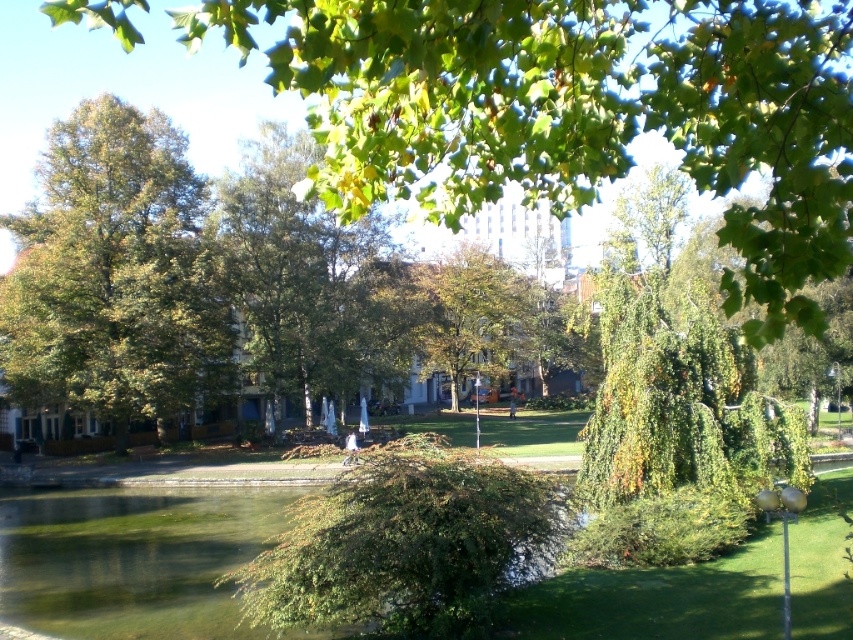
Which is below, green leafy tree at left or green translucent water at lower left?

green translucent water at lower left is lower down.

Who is positioned more to the right, green leafy tree at left or green translucent water at lower left?

Positioned to the right is green translucent water at lower left.

Locate an element on the screen. green leafy tree at left is located at coordinates click(x=114, y=273).

Image resolution: width=853 pixels, height=640 pixels. What are the coordinates of `green leafy tree at left` in the screenshot? It's located at (114, 273).

What do you see at coordinates (578, 113) in the screenshot?
I see `green leafy tree at upper center` at bounding box center [578, 113].

Who is more distant from viewer, (735, 61) or (229, 600)?

Positioned behind is point (229, 600).

Who is more distant from viewer, (x=815, y=124) or (x=91, y=596)?

The point (x=91, y=596) is behind.

Image resolution: width=853 pixels, height=640 pixels. In order to click on green leafy tree at upper center in this screenshot , I will do point(578,113).

Can you confirm if green leafy tree at upper center is taller than green leafy tree at left?

Yes, green leafy tree at upper center is taller than green leafy tree at left.

Is point (801, 84) farther from camera compared to point (138, 160)?

No, it is in front of (138, 160).

Is point (840, 179) positioned behind point (91, 131)?

No, it is in front of (91, 131).

You are a GUI agent. You are given a task and a screenshot of the screen. Output one action in this format:
    pyautogui.click(x=<x>, y=<y>)
    Task: Click on the green leafy tree at upper center
    This screenshot has height=640, width=853.
    Given the screenshot: What is the action you would take?
    pyautogui.click(x=578, y=113)